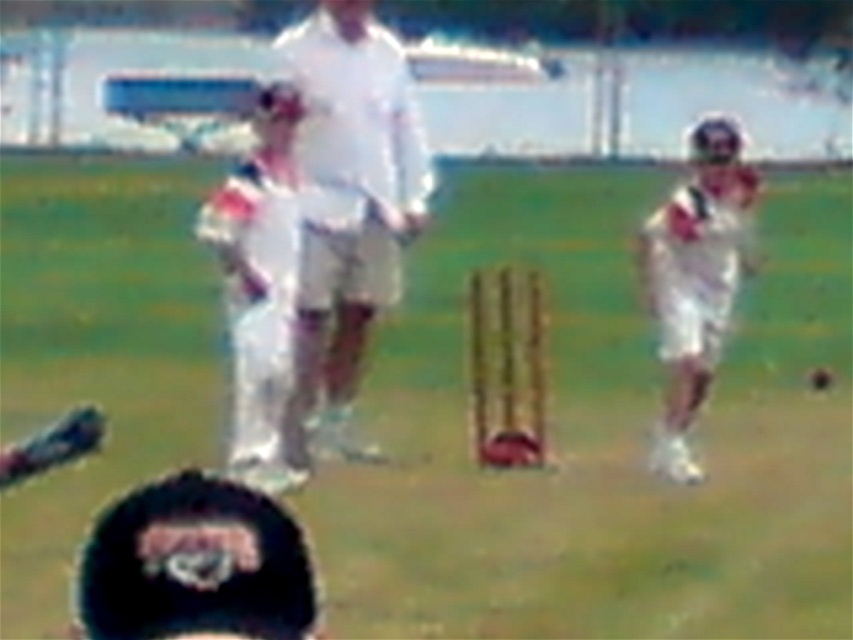
Question: Is black fabric cap at lower left closer to camera compared to white matte uniform at center?

Choices:
 (A) no
 (B) yes

Answer: (B)

Question: Which object is the closest to the white cloth cricket bat at center?

Choices:
 (A) black fabric cap at lower left
 (B) white matte uniform at center

Answer: (A)

Question: Does black fabric cap at lower left come behind white matte uniform at center?

Choices:
 (A) yes
 (B) no

Answer: (B)

Question: Which point is closer to the camera?

Choices:
 (A) (355, 96)
 (B) (732, 188)
 (C) (207, 472)

Answer: (C)

Question: Which is farther from the white matte uniform at center?

Choices:
 (A) black fabric cap at lower left
 (B) white cloth cricket bat at center

Answer: (B)

Question: Does white cloth cricket bat at center appear under white matte uniform at center?

Choices:
 (A) no
 (B) yes

Answer: (B)